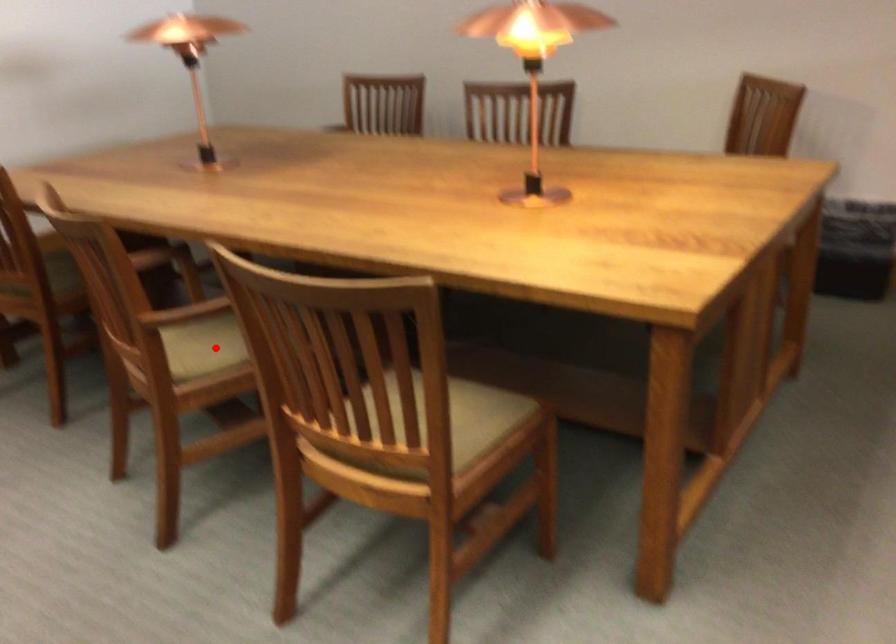
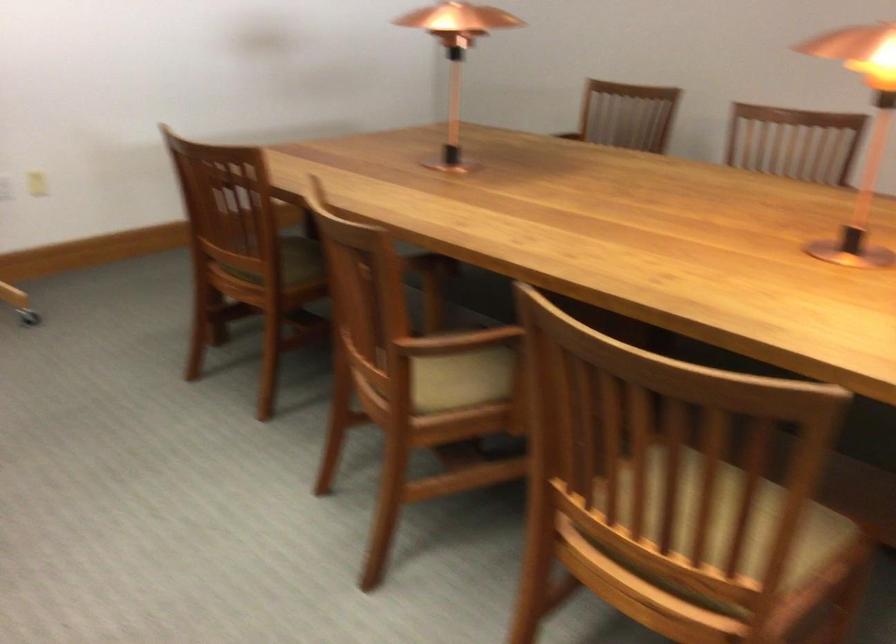
In the second image, find the point that corresponds to the highlighted location in the first image.

(460, 377)